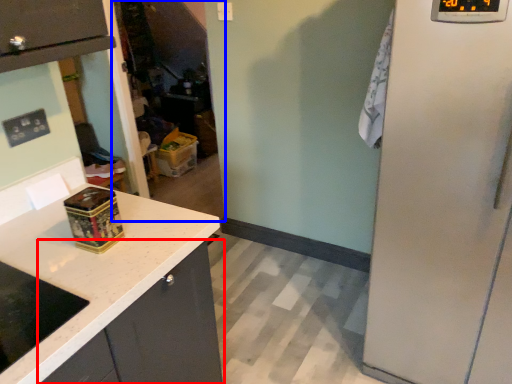
Question: Which object appears closest to the camera in this image, cabinetry (highlighted by a red box) or glass door (highlighted by a blue box)?

Choices:
 (A) cabinetry
 (B) glass door

Answer: (A)